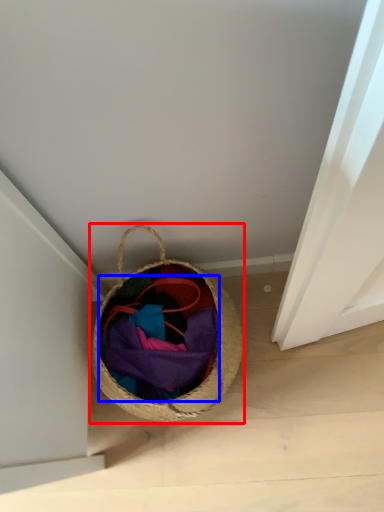
Question: Which of the following is the closest to the observer, picnic basket (highlighted by a red box) or clothing (highlighted by a blue box)?

Choices:
 (A) picnic basket
 (B) clothing

Answer: (A)